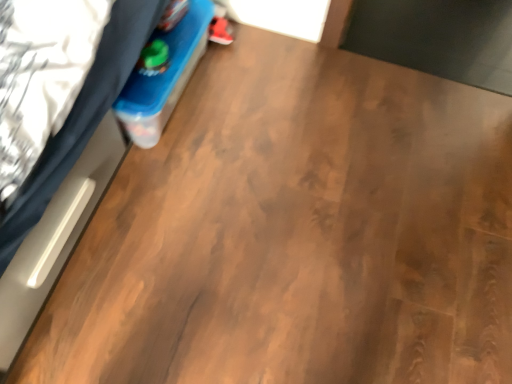
What do you see at coordinates (220, 31) in the screenshot?
I see `matte red sneaker at upper center` at bounding box center [220, 31].

Where is `matte red sneaker at upper center`? matte red sneaker at upper center is located at coordinates (220, 31).

The image size is (512, 384). What do you see at coordinates (81, 117) in the screenshot? I see `white matte bed at left` at bounding box center [81, 117].

Image resolution: width=512 pixels, height=384 pixels. Identify the location of white matte bed at left. (81, 117).

I want to click on matte red sneaker at upper center, so click(x=220, y=31).

Between matte red sneaker at upper center and white matte bed at left, which one appears on the left side from the viewer's perspective?

Positioned to the left is white matte bed at left.

Is matte red sneaker at upper center closer to the viewer compared to white matte bed at left?

No, matte red sneaker at upper center is further to the viewer.

Between point (224, 22) and point (59, 144), which one is positioned in front?

The point (59, 144) is closer.

From the image's perspective, between matte red sneaker at upper center and white matte bed at left, who is located below?

white matte bed at left is shown below in the image.

From a real-world perspective, is matte red sneaker at upper center positioned over white matte bed at left based on gravity?

No.

Which of these two, matte red sneaker at upper center or white matte bed at left, is wider?

Wider between the two is white matte bed at left.

In terms of height, does matte red sneaker at upper center look taller or shorter compared to white matte bed at left?

In the image, matte red sneaker at upper center appears to be shorter than white matte bed at left.

Which of these two, matte red sneaker at upper center or white matte bed at left, is smaller?

With smaller size is matte red sneaker at upper center.

Is matte red sneaker at upper center inside the boundaries of white matte bed at left, or outside?

matte red sneaker at upper center cannot be found inside white matte bed at left.

Is matte red sneaker at upper center far away from white matte bed at left?

No, there isn't a large distance between matte red sneaker at upper center and white matte bed at left.

In the scene shown: Is matte red sneaker at upper center oriented towards white matte bed at left?

Yes, matte red sneaker at upper center is facing white matte bed at left.

How many degrees apart are the facing directions of matte red sneaker at upper center and white matte bed at left?

The angle between the facing direction of matte red sneaker at upper center and the facing direction of white matte bed at left is 90 degrees.

Identify the location of bed above the matte red sneaker at upper center (from a real-world perspective). (81, 117).

Is white matte bed at left to the right of matte red sneaker at upper center from the viewer's perspective?

No, white matte bed at left is not to the right of matte red sneaker at upper center.

Is white matte bed at left closer to camera compared to matte red sneaker at upper center?

Yes, it is in front of matte red sneaker at upper center.

Does point (74, 122) appear closer or farther from the camera than point (221, 32)?

Point (74, 122) is closer to the camera than point (221, 32).

From the image's perspective, which one is positioned higher, white matte bed at left or matte red sneaker at upper center?

matte red sneaker at upper center appears higher in the image.

From a real-world perspective, who is located higher, white matte bed at left or matte red sneaker at upper center?

In real-world perspective, white matte bed at left is above.

Can you confirm if white matte bed at left is wider than matte red sneaker at upper center?

Indeed, white matte bed at left has a greater width compared to matte red sneaker at upper center.

Is white matte bed at left shorter than matte red sneaker at upper center?

In fact, white matte bed at left may be taller than matte red sneaker at upper center.

Is white matte bed at left bigger or smaller than matte red sneaker at upper center?

Clearly, white matte bed at left is larger in size than matte red sneaker at upper center.

Looking at this image, does white matte bed at left contain matte red sneaker at upper center?

No, matte red sneaker at upper center is not a part of white matte bed at left.

Are white matte bed at left and matte red sneaker at upper center far apart?

No, white matte bed at left is not far away from matte red sneaker at upper center.

Is white matte bed at left facing away from matte red sneaker at upper center?

No.

How many degrees apart are the facing directions of white matte bed at left and matte red sneaker at upper center?

90 degrees separate the facing orientations of white matte bed at left and matte red sneaker at upper center.

Where is `bed in front of the matte red sneaker at upper center`? The height and width of the screenshot is (384, 512). bed in front of the matte red sneaker at upper center is located at coordinates (81, 117).

Locate an element on the screen. Image resolution: width=512 pixels, height=384 pixels. footwear behind the white matte bed at left is located at coordinates pos(220,31).

Where is `footwear above the white matte bed at left (from the image's perspective)`? This screenshot has height=384, width=512. footwear above the white matte bed at left (from the image's perspective) is located at coordinates (220, 31).